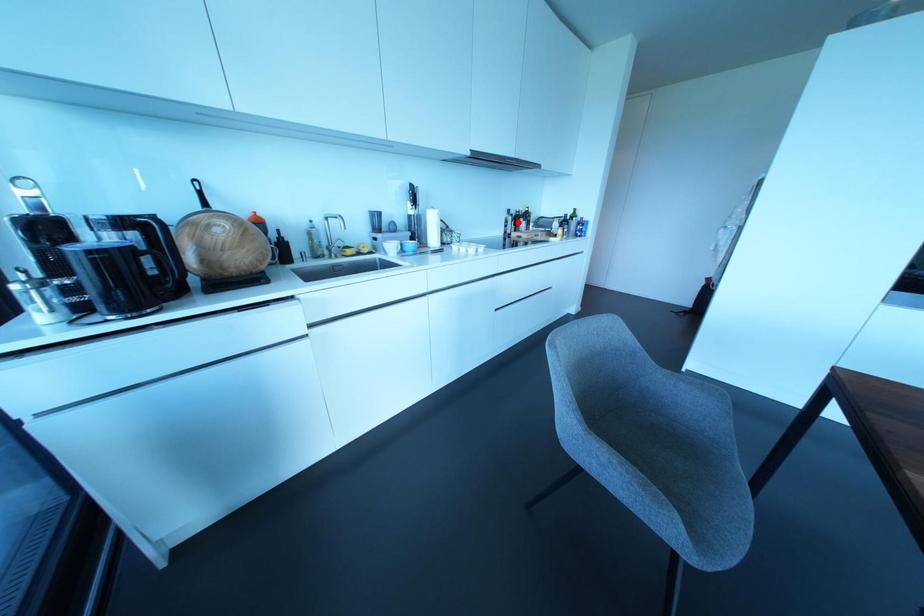
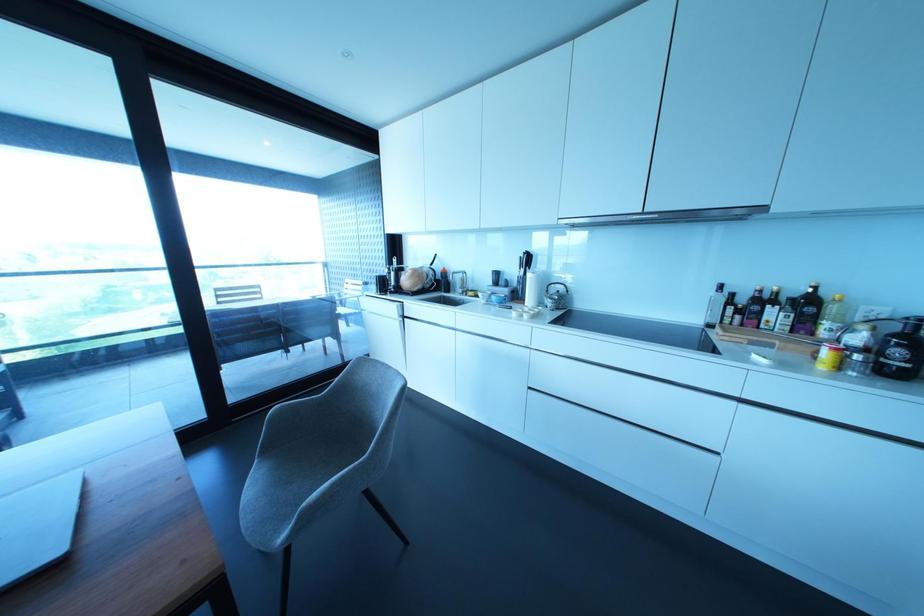
Find the pixel in the second image that matches the highlighted location in the first image.

(760, 313)